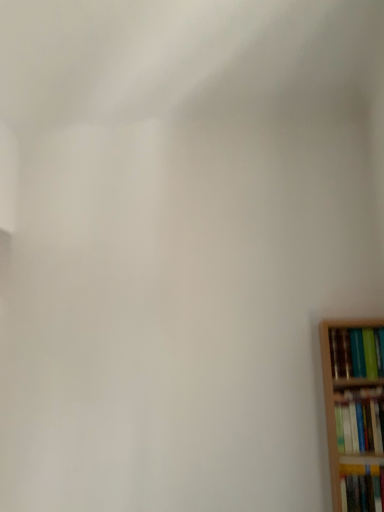
Question: From the image's perspective, would you say hardcover book at right, which is the 3th book in bottom-to-top order, is shown under hardcover book at right, which is the second book from bottom to top?

Choices:
 (A) no
 (B) yes

Answer: (A)

Question: Can you see hardcover book at right, which is the 3th book in bottom-to-top order, touching hardcover book at right, the second book in the top-to-bottom sequence?

Choices:
 (A) no
 (B) yes

Answer: (A)

Question: Does hardcover book at right, the first book when ordered from top to bottom, have a lesser width compared to hardcover book at right, the second book in the top-to-bottom sequence?

Choices:
 (A) yes
 (B) no

Answer: (B)

Question: Is hardcover book at right, which is the 3th book in bottom-to-top order, in front of hardcover book at right, which is the second book from bottom to top?

Choices:
 (A) no
 (B) yes

Answer: (A)

Question: Is hardcover book at right, which is the 3th book in bottom-to-top order, far away from hardcover book at right, the second book in the top-to-bottom sequence?

Choices:
 (A) yes
 (B) no

Answer: (B)

Question: Is hardcover book at right, which is the 3th book in bottom-to-top order, positioned behind hardcover book at right, which is the second book from bottom to top?

Choices:
 (A) yes
 (B) no

Answer: (A)

Question: Can you confirm if hardcover book at right, the first book when ordered from top to bottom, is wider than hardcover book at lower right, positioned as the first book in bottom-to-top order?

Choices:
 (A) no
 (B) yes

Answer: (B)

Question: Is hardcover book at lower right, positioned as the first book in bottom-to-top order, at the back of hardcover book at right, the first book when ordered from top to bottom?

Choices:
 (A) no
 (B) yes

Answer: (A)

Question: Can you confirm if hardcover book at right, which is the 3th book in bottom-to-top order, is smaller than hardcover book at lower right, positioned as the first book in bottom-to-top order?

Choices:
 (A) yes
 (B) no

Answer: (B)

Question: Is hardcover book at right, which is the 3th book in bottom-to-top order, thinner than hardcover book at lower right, the third book in the top-to-bottom sequence?

Choices:
 (A) no
 (B) yes

Answer: (A)

Question: Would you consider hardcover book at right, which is the 3th book in bottom-to-top order, to be distant from hardcover book at lower right, the third book in the top-to-bottom sequence?

Choices:
 (A) no
 (B) yes

Answer: (A)

Question: Is hardcover book at right, the first book when ordered from top to bottom, further to the viewer compared to hardcover book at lower right, the third book in the top-to-bottom sequence?

Choices:
 (A) yes
 (B) no

Answer: (A)

Question: Are hardcover book at lower right, positioned as the first book in bottom-to-top order, and hardcover book at right, the first book when ordered from top to bottom, far apart?

Choices:
 (A) no
 (B) yes

Answer: (A)